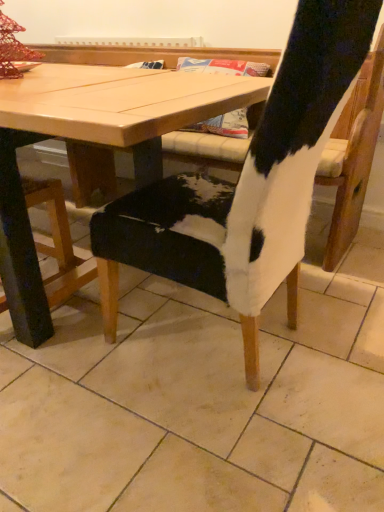
At what (x,y) coordinates should I click in order to perform the action: click on free space in front of cowhide chair at center. Please return your answer as a coordinate pair (x, y). The height and width of the screenshot is (512, 384). Looking at the image, I should click on (213, 451).